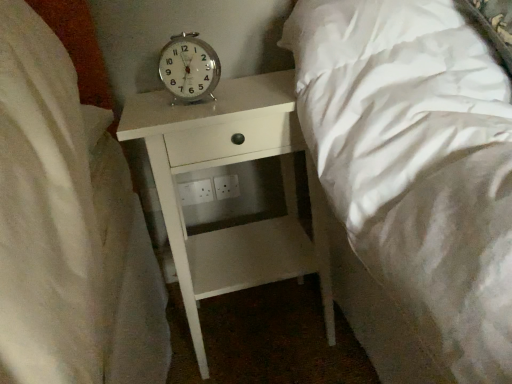
Image resolution: width=512 pixels, height=384 pixels. I want to click on vacant space underneath white matte nightstand at center (from a real-world perspective), so click(252, 324).